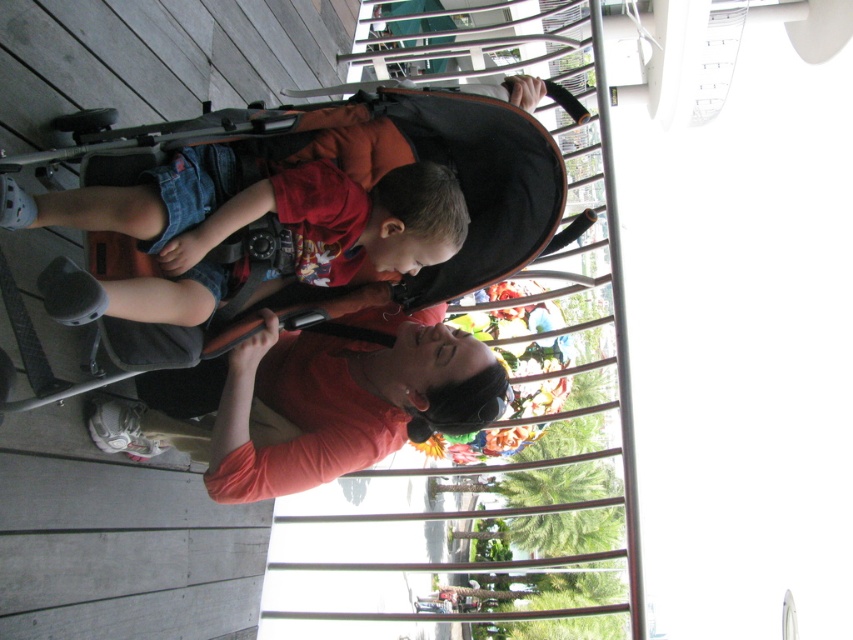
Question: Which object is positioned closest to the black fabric stroller at center?

Choices:
 (A) orange matte shirt at center
 (B) denim shorts at center

Answer: (B)

Question: Which point is closer to the camera taking this photo?

Choices:
 (A) (247, 356)
 (B) (209, 236)

Answer: (B)

Question: In this image, where is orange matte shirt at center located relative to denim shorts at center?

Choices:
 (A) below
 (B) above

Answer: (A)

Question: Which of the following is the closest to the observer?

Choices:
 (A) (207, 449)
 (B) (189, 248)

Answer: (B)

Question: Is black fabric stroller at center above orange matte shirt at center?

Choices:
 (A) no
 (B) yes

Answer: (B)

Question: Observing the image, what is the correct spatial positioning of orange matte shirt at center in reference to denim shorts at center?

Choices:
 (A) above
 (B) below

Answer: (B)